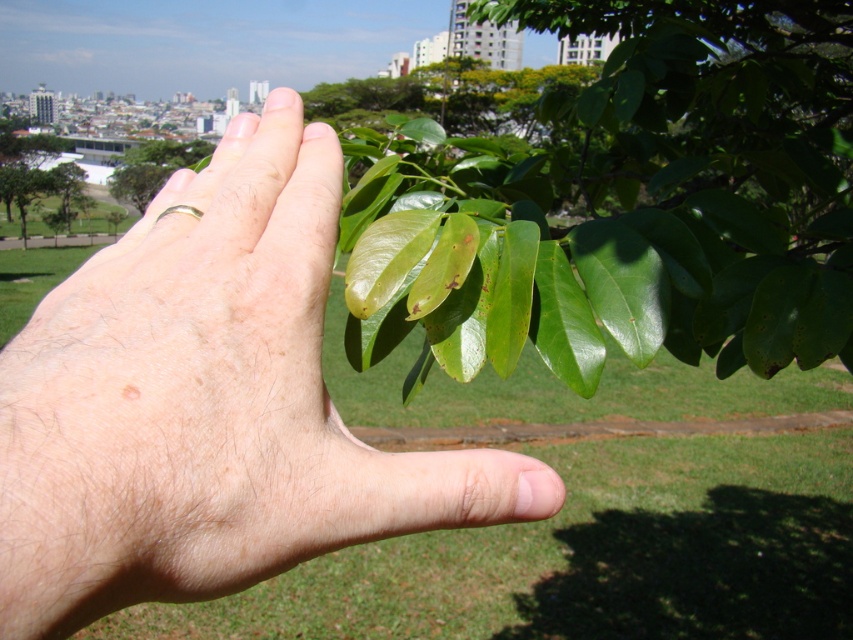
Can you confirm if green glossy leaves at upper center is positioned below green glossy leaf at upper center?

Yes, green glossy leaves at upper center is below green glossy leaf at upper center.

Between green glossy leaves at upper center and green glossy leaf at upper center, which one has more height?

green glossy leaf at upper center is taller.

Does point (666, 211) come in front of point (151, 150)?

Yes.

Find the location of a particular element. green glossy leaves at upper center is located at coordinates (630, 202).

Which is behind, point (422, 378) or point (70, 179)?

The point (70, 179) is more distant.

Where is `green glossy leaves at upper center`? green glossy leaves at upper center is located at coordinates (630, 202).

Locate an element on the screen. green glossy leaves at upper center is located at coordinates (630, 202).

Who is shorter, pale skin/hair at center or green glossy leaf at upper center?

pale skin/hair at center is shorter.

Can you confirm if pale skin/hair at center is positioned to the left of green glossy leaf at upper center?

Incorrect, pale skin/hair at center is not on the left side of green glossy leaf at upper center.

Is point (199, 314) positioned behind point (122, 177)?

No.

Find the location of a particular element. The image size is (853, 640). pale skin/hair at center is located at coordinates (207, 403).